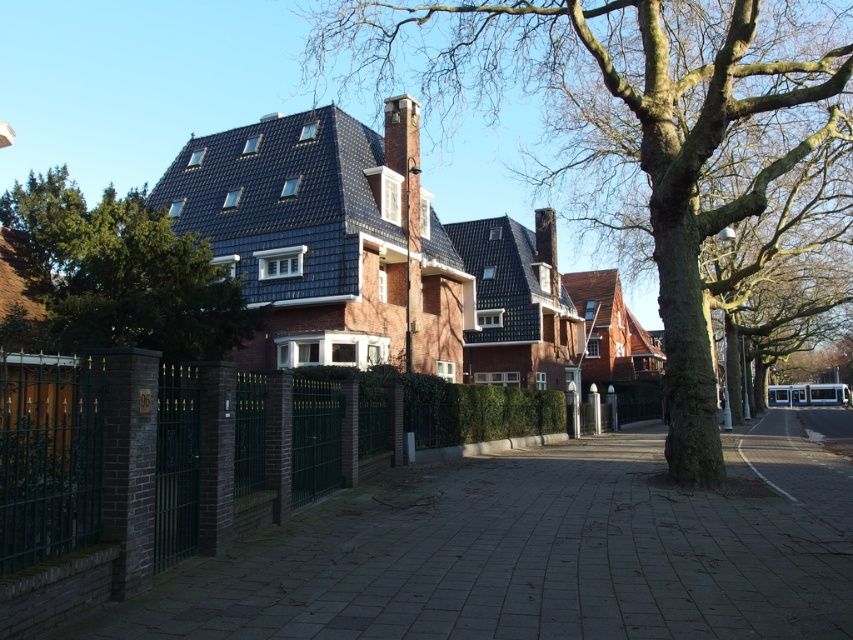
You are standing at the entrance of the house and want to walk directly to the smooth bark tree at center. Which direction should you face to walk straight towards it?

Since the smooth bark tree at center is located at point (x=635, y=125) in the image, you should face towards the center of the image to walk straight towards it.

You are standing on the sidewalk and want to walk to the house. Which tree should you pass first, the smooth bark tree at center or the green leafy tree at upper left?

The smooth bark tree at center is closer to you, so you will pass it first on your way to the house.